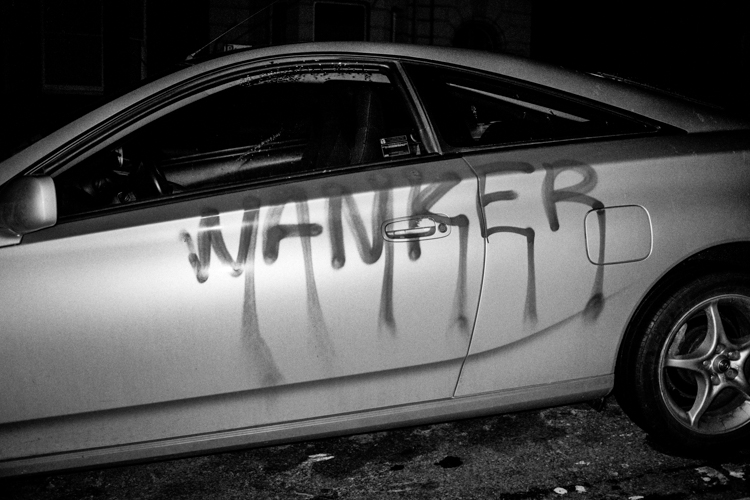
You are a GUI agent. You are given a task and a screenshot of the screen. Output one action in this format:
    pyautogui.click(x=<x>, y=<y>)
    Task: Click on the window
    
    Given the screenshot: What is the action you would take?
    pyautogui.click(x=241, y=137)